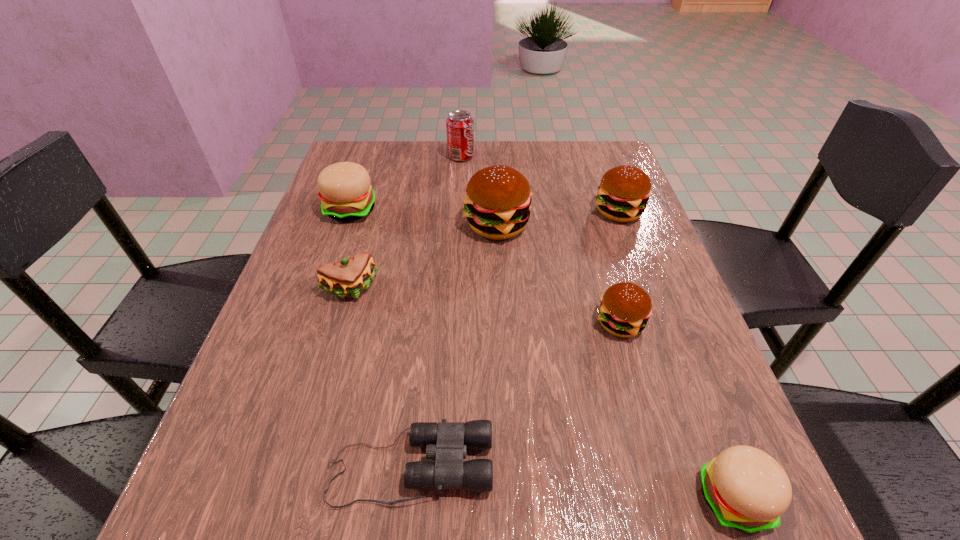
The image size is (960, 540). I want to click on the biggest brown hamburger, so click(497, 202).

Identify the location of the tallest hamburger. (497, 202).

Identify the location of the farthest object. The width and height of the screenshot is (960, 540). (459, 125).

Locate an element on the screen. Image resolution: width=960 pixels, height=540 pixels. the second biggest brown hamburger is located at coordinates click(624, 191).

This screenshot has width=960, height=540. In order to click on the bigger beige hamburger in this screenshot , I will do `click(345, 192)`.

I want to click on the left beige hamburger, so click(x=345, y=192).

Locate an element on the screen. The width and height of the screenshot is (960, 540). sandwich is located at coordinates (350, 277).

Where is `the smallest brown hamburger`? the smallest brown hamburger is located at coordinates (625, 308).

You are a GUI agent. You are given a task and a screenshot of the screen. Output one action in this format:
    pyautogui.click(x=<x>, y=<y>)
    Task: Click on the nearest brown hamburger
    The width and height of the screenshot is (960, 540).
    Given the screenshot: What is the action you would take?
    pyautogui.click(x=625, y=308)

The height and width of the screenshot is (540, 960). I want to click on the smaller beige hamburger, so click(x=747, y=489).